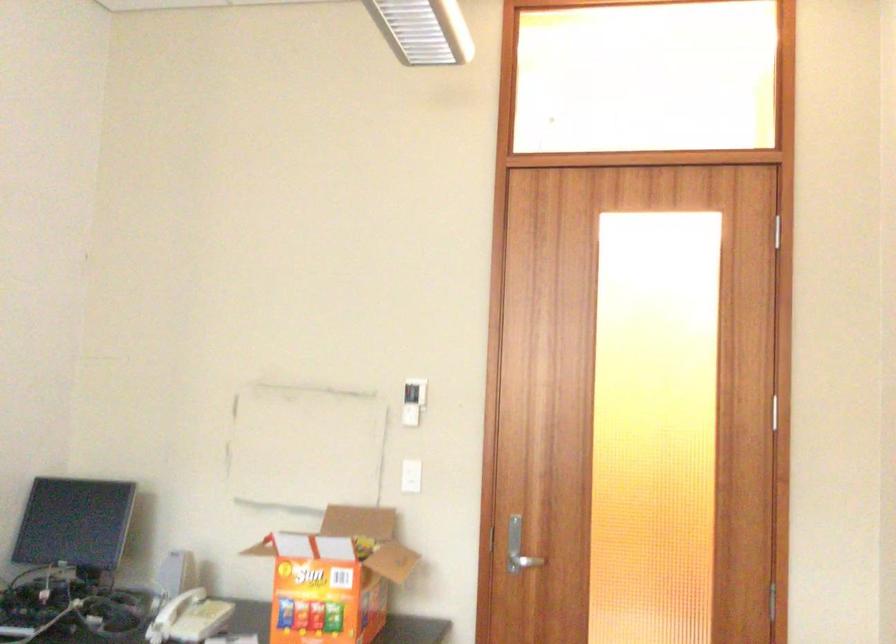
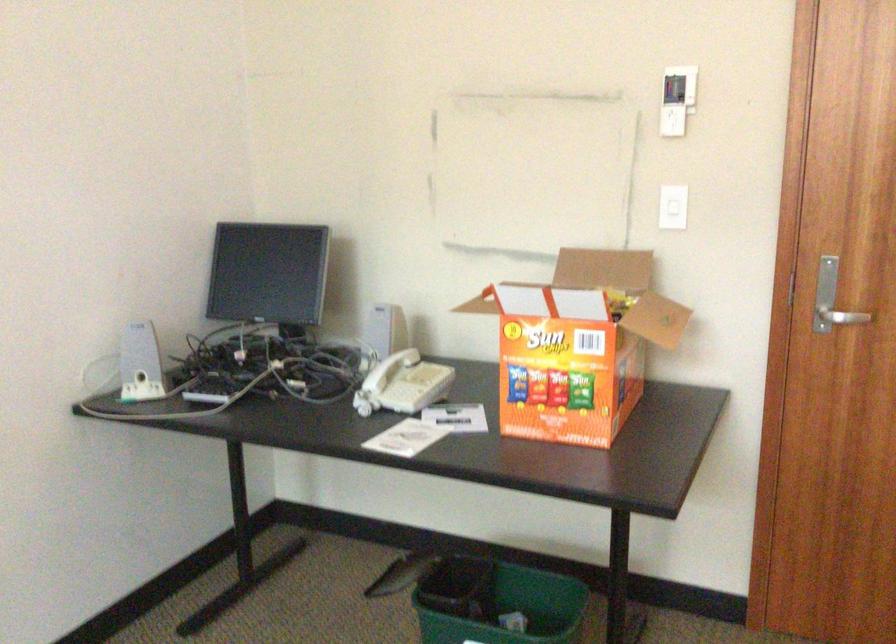
In the second image, find the point that corresponds to point 331,576 in the first image.

(578, 345)